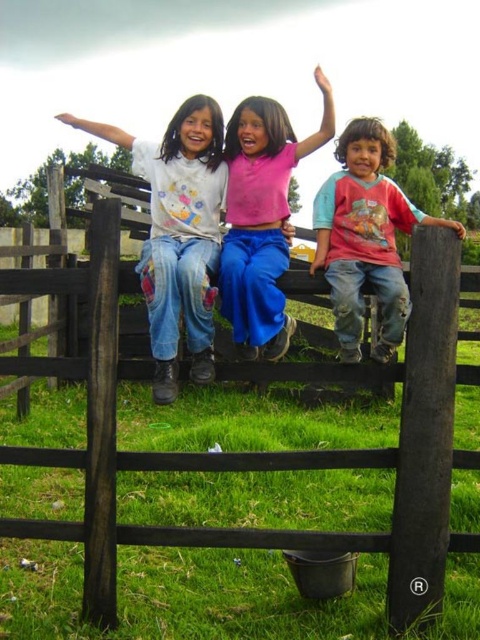
Who is positioned more to the left, pink matte shirt at center or rough denim jeans at right?

rough denim jeans at right

Between point (266, 257) and point (362, 205), which one is positioned behind?

Positioned behind is point (362, 205).

This screenshot has width=480, height=640. Describe the element at coordinates (262, 218) in the screenshot. I see `pink matte shirt at center` at that location.

The width and height of the screenshot is (480, 640). I want to click on pink matte shirt at center, so click(x=262, y=218).

Does black wooden fence at center have a greater width compared to pink matte shirt at center?

Incorrect, black wooden fence at center's width does not surpass pink matte shirt at center's.

Can you confirm if black wooden fence at center is bigger than pink matte shirt at center?

No.

What do you see at coordinates (261, 451) in the screenshot? This screenshot has width=480, height=640. I see `black wooden fence at center` at bounding box center [261, 451].

This screenshot has height=640, width=480. I want to click on black wooden fence at center, so click(x=261, y=451).

In the scene shown: Who is positioned more to the right, black wooden fence at center or denim jeans at left?

From the viewer's perspective, black wooden fence at center appears more on the right side.

Consider the image. Between black wooden fence at center and denim jeans at left, which one is positioned lower?

Positioned lower is black wooden fence at center.

Which is behind, point (104, 586) or point (177, 312)?

The point (104, 586) is more distant.

You are a GUI agent. You are given a task and a screenshot of the screen. Output one action in this format:
    pyautogui.click(x=<x>, y=<y>)
    Task: Click on the black wooden fence at center
    This screenshot has height=640, width=480.
    Given the screenshot: What is the action you would take?
    pyautogui.click(x=261, y=451)